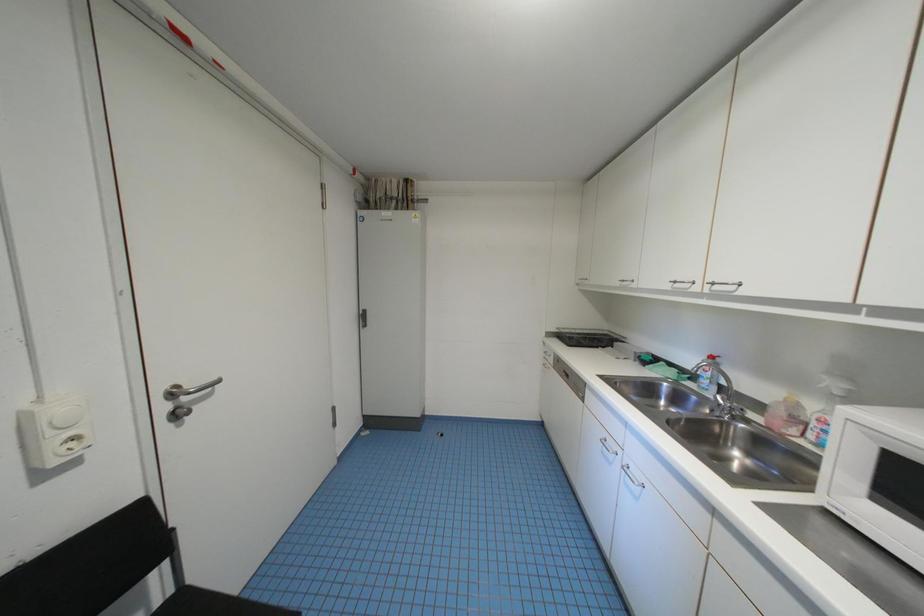
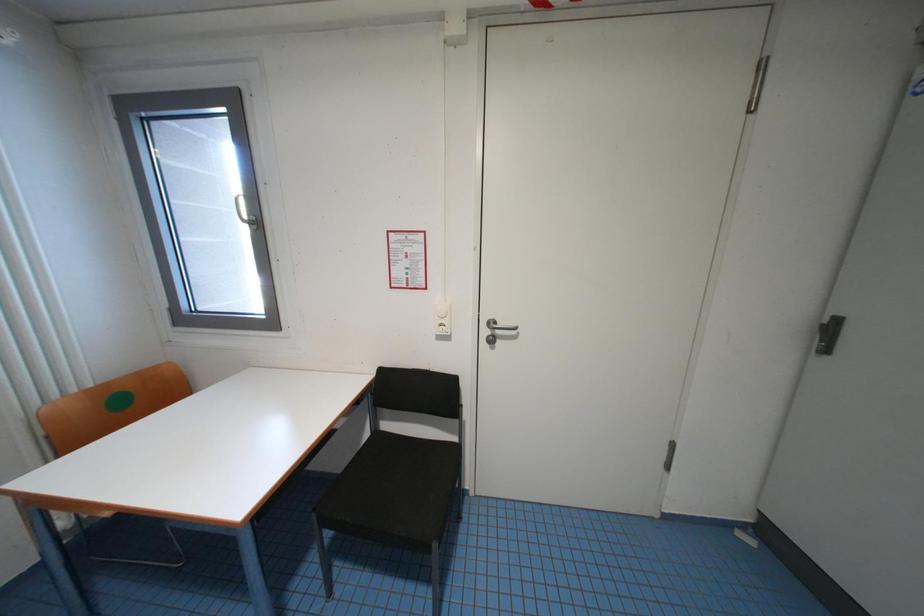
Question: The camera is either moving clockwise (left) or counter-clockwise (right) around the object. The first image is from the beginning of the video and the second image is from the end. Is the camera moving left or right when shooting the video?

Choices:
 (A) Left
 (B) Right

Answer: (B)